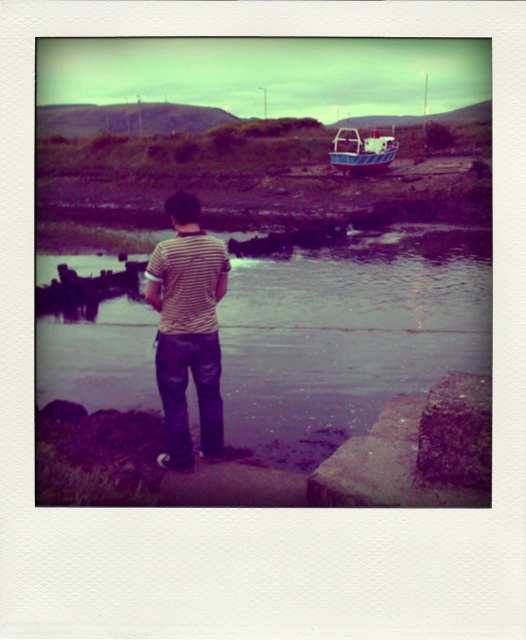
You are standing at the point marked by coordinates point (x=348, y=333). Looking around, you see a person wearing a horizontally striped shirt and dark pants on rocky terrain. Which direction should you walk to reach the purple water at center?

The point (x=348, y=333) is already at the purple water at center, so you are already there.

You are standing at the point marked by the coordinates point (187, 330). What object is located at your current position?

The striped cotton shirt at center is located at point (187, 330).

In the scene shown: You are a photographer trying to capture the blue painted wooden boat at upper right and the purple water at center in the same frame. Based on their positions, can you tell me which object is closer to the camera?

The blue painted wooden boat at upper right is closer to the camera because it is positioned above the purple water at center, which is located below it.